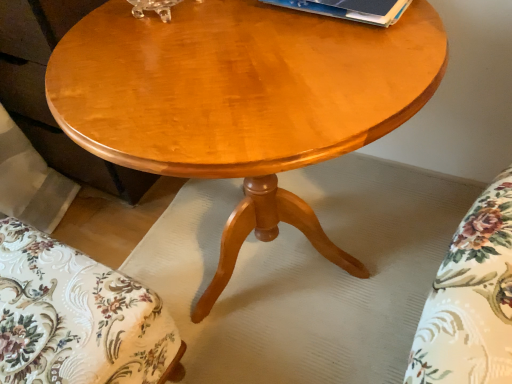
Question: Is blue paper at upper center smaller than glossy wood coffee table at center?

Choices:
 (A) yes
 (B) no

Answer: (A)

Question: Is the depth of blue paper at upper center less than that of glossy wood coffee table at center?

Choices:
 (A) yes
 (B) no

Answer: (B)

Question: From the image's perspective, does blue paper at upper center appear lower than glossy wood coffee table at center?

Choices:
 (A) yes
 (B) no

Answer: (B)

Question: From a real-world perspective, is blue paper at upper center positioned over glossy wood coffee table at center based on gravity?

Choices:
 (A) no
 (B) yes

Answer: (B)

Question: Is blue paper at upper center behind glossy wood coffee table at center?

Choices:
 (A) no
 (B) yes

Answer: (B)

Question: Is blue paper at upper center aimed at glossy wood coffee table at center?

Choices:
 (A) no
 (B) yes

Answer: (A)

Question: From the image's perspective, is glossy wood coffee table at center over blue paper at upper center?

Choices:
 (A) yes
 (B) no

Answer: (B)

Question: Is glossy wood coffee table at center thinner than blue paper at upper center?

Choices:
 (A) no
 (B) yes

Answer: (A)

Question: From a real-world perspective, is glossy wood coffee table at center on top of blue paper at upper center?

Choices:
 (A) yes
 (B) no

Answer: (B)

Question: Is glossy wood coffee table at center not near blue paper at upper center?

Choices:
 (A) no
 (B) yes

Answer: (A)

Question: Is glossy wood coffee table at center shorter than blue paper at upper center?

Choices:
 (A) no
 (B) yes

Answer: (A)

Question: Does glossy wood coffee table at center come behind blue paper at upper center?

Choices:
 (A) no
 (B) yes

Answer: (A)

Question: Considering the relative sizes of floral fabric cushion at lower left and blue paper at upper center in the image provided, is floral fabric cushion at lower left thinner than blue paper at upper center?

Choices:
 (A) no
 (B) yes

Answer: (A)